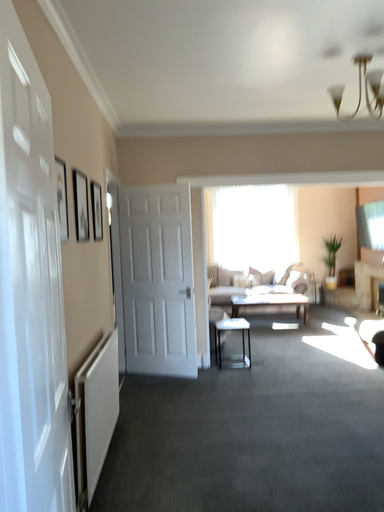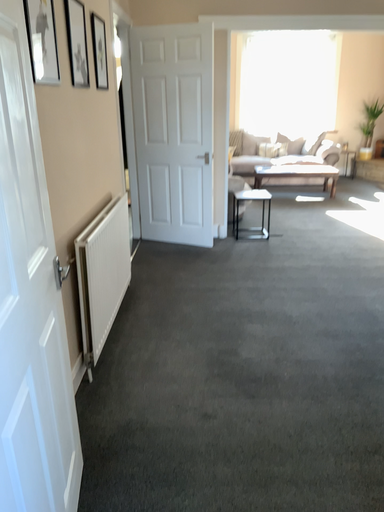
Question: Which way did the camera rotate in the video?

Choices:
 (A) rotated downward
 (B) rotated upward

Answer: (A)